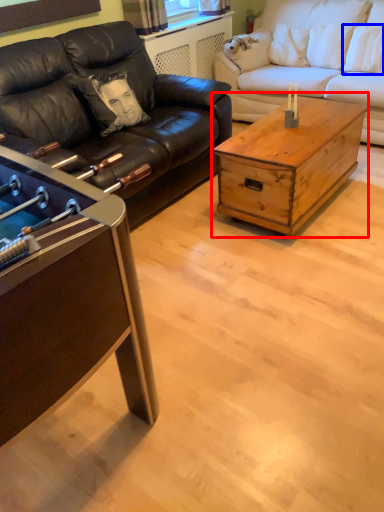
Question: Which of the following is the closest to the observer, coffee table (highlighted by a red box) or pillow (highlighted by a blue box)?

Choices:
 (A) coffee table
 (B) pillow

Answer: (A)